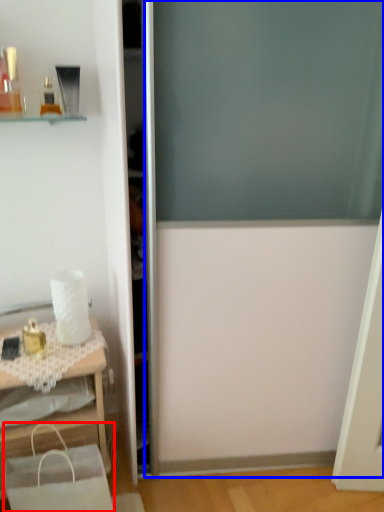
Question: Which object is further to the camera taking this photo, shopping bag (highlighted by a red box) or screen door (highlighted by a blue box)?

Choices:
 (A) shopping bag
 (B) screen door

Answer: (A)